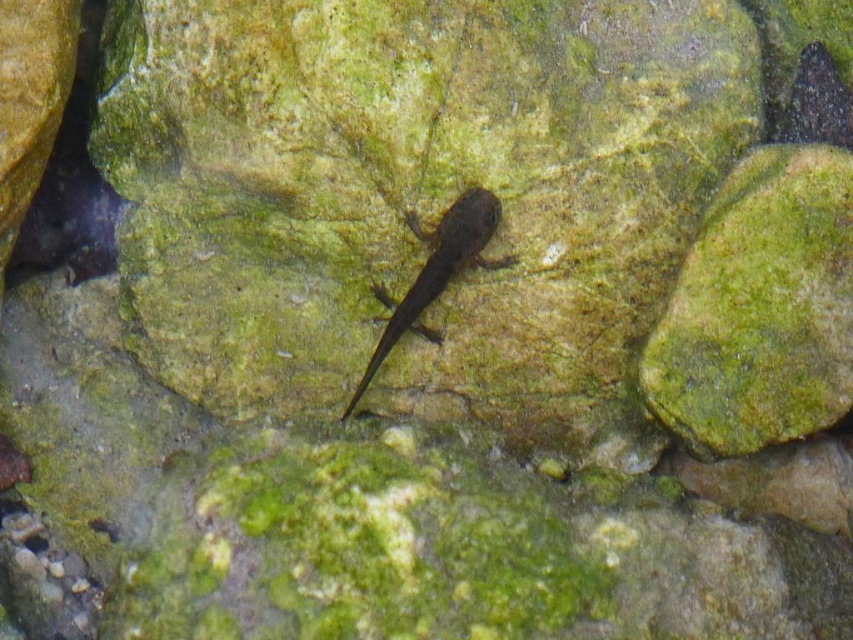
Is dark brown smooth salamander at center further to camera compared to shiny black fish at upper right?

Yes, it is.

Is point (479, 248) positioned behind point (811, 74)?

No.

I want to click on dark brown smooth salamander at center, so click(x=436, y=272).